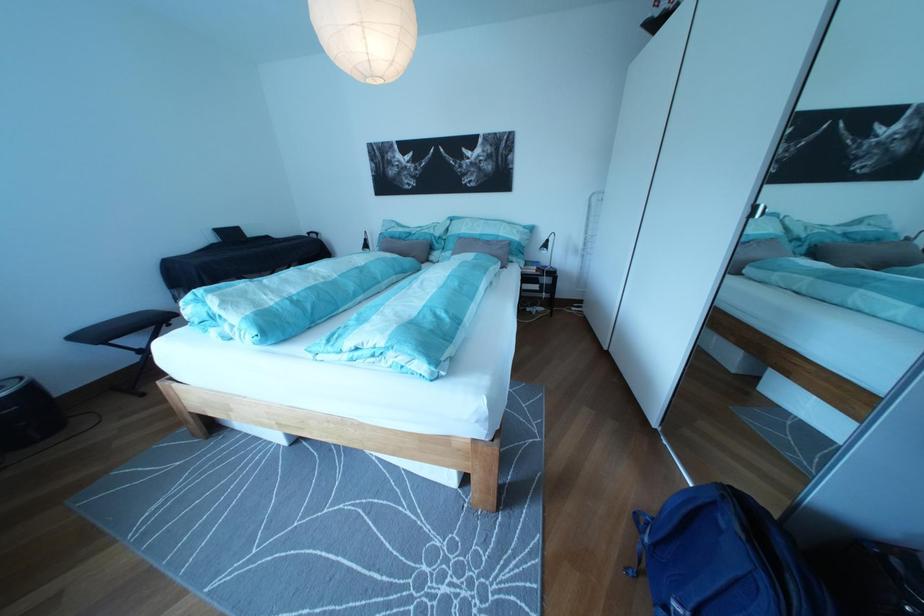
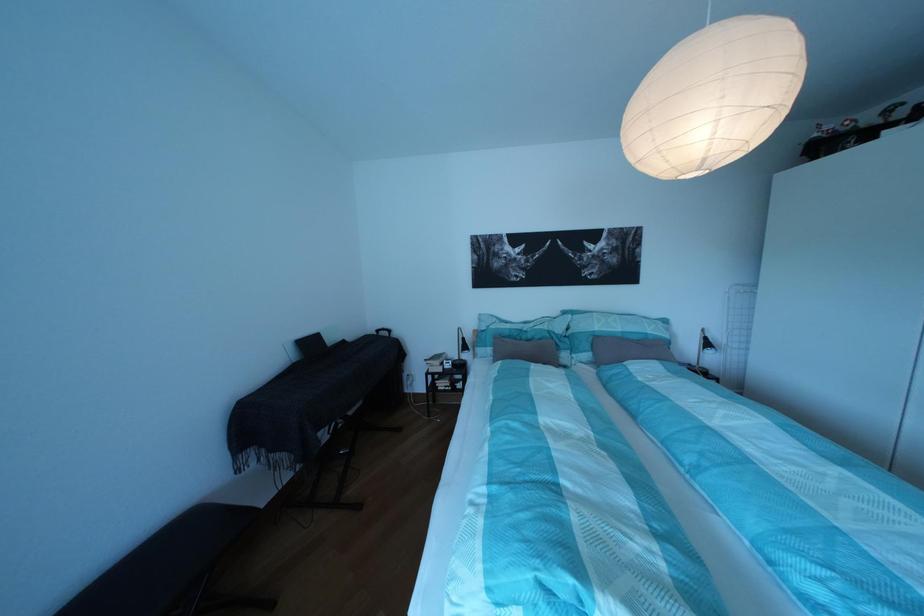
The point at (463, 227) is marked in the first image. Where is the corresponding point in the second image?

(582, 322)